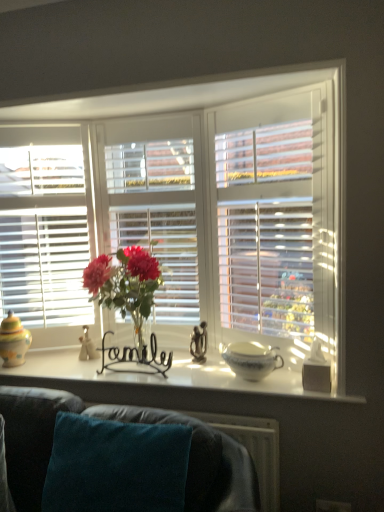
Image resolution: width=384 pixels, height=512 pixels. Identify the location of vacant area that lies between white ceramic bowl at center and black wire at center, positioned as the second candle holder in right-to-left order. (185, 371).